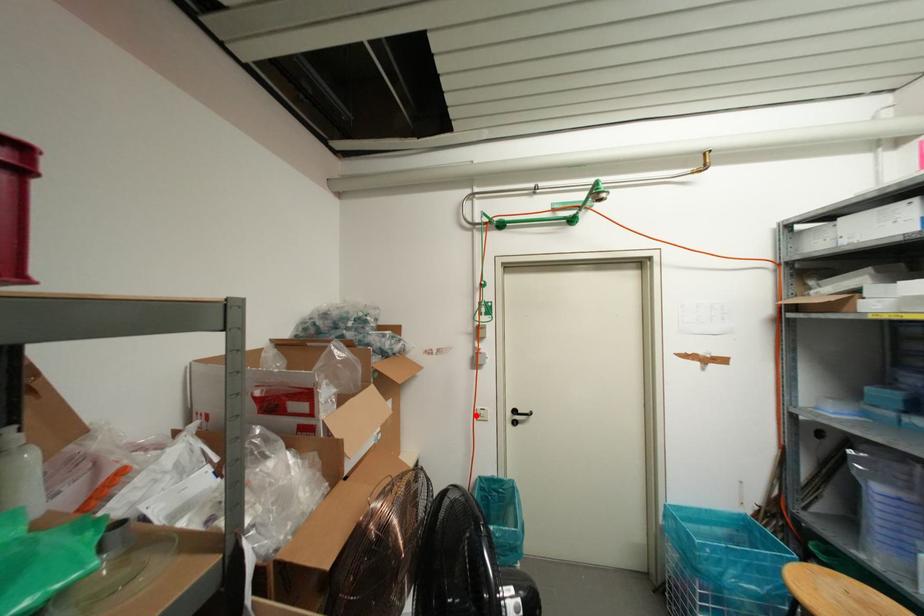
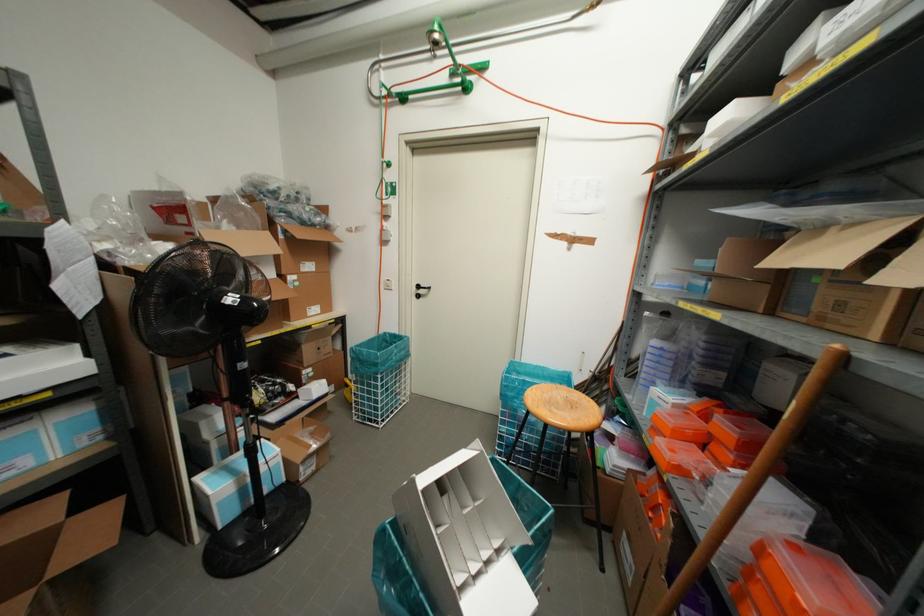
Where in the second image is the point corresponding to the highlighted location from the first image?

(382, 285)